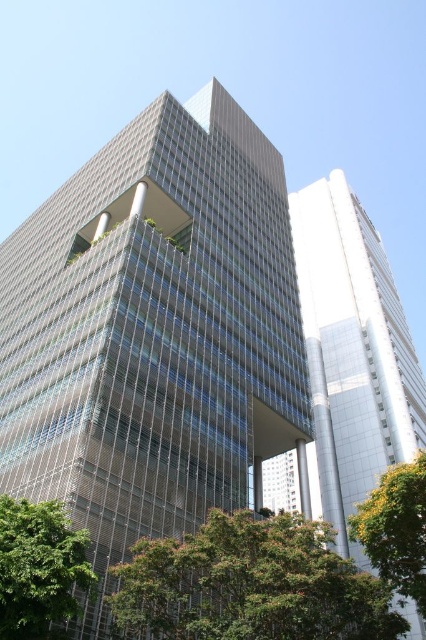
Image resolution: width=426 pixels, height=640 pixels. Find the location of `metallic glass building at center`. metallic glass building at center is located at coordinates (152, 332).

The height and width of the screenshot is (640, 426). In order to click on metallic glass building at center in this screenshot , I will do `click(152, 332)`.

Which is more to the right, sleek silver building at right or green leafy tree at lower left?

Positioned to the right is sleek silver building at right.

Find the location of a particular element. The height and width of the screenshot is (640, 426). sleek silver building at right is located at coordinates (353, 352).

Does point (322, 346) come closer to viewer compared to point (16, 552)?

No, (322, 346) is behind (16, 552).

The image size is (426, 640). Identify the location of sleek silver building at right. [x=353, y=352].

Which is more to the right, green leafy tree at lower center or green leafy tree at lower right?

Positioned to the right is green leafy tree at lower right.

Can you confirm if green leafy tree at lower center is wider than green leafy tree at lower right?

Correct, the width of green leafy tree at lower center exceeds that of green leafy tree at lower right.

This screenshot has width=426, height=640. Describe the element at coordinates (250, 584) in the screenshot. I see `green leafy tree at lower center` at that location.

You are a GUI agent. You are given a task and a screenshot of the screen. Output one action in this format:
    pyautogui.click(x=<x>, y=<y>)
    Task: Click on the green leafy tree at lower center
    Image resolution: width=426 pixels, height=640 pixels.
    Given the screenshot: What is the action you would take?
    [x=250, y=584]